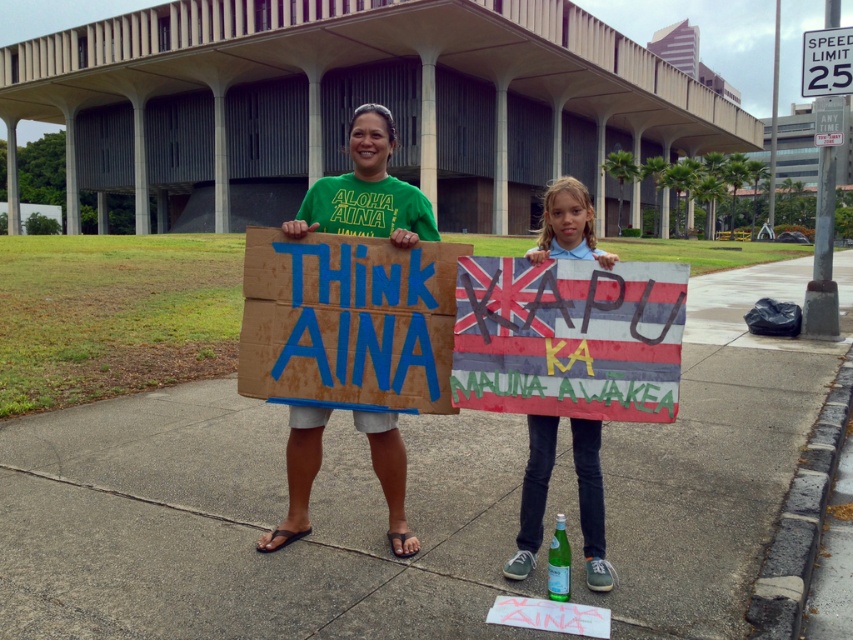
Question: Which of the following is the farthest from the observer?

Choices:
 (A) matte cardboard sign at center
 (B) cardboard sign at center
 (C) white cotton shirt at center
 (D) brown concrete pavement at center

Answer: (A)

Question: Is the position of matte cardboard sign at center more distant than that of white plastic speed limit sign at upper right?

Choices:
 (A) yes
 (B) no

Answer: (B)

Question: Which of the following is the farthest from the observer?

Choices:
 (A) (851, 60)
 (B) (392, 131)

Answer: (A)

Question: Which point is farther to the camera?

Choices:
 (A) white cotton shirt at center
 (B) hand-painted fabric sign at center
 (C) brown concrete pavement at center
 (D) matte cardboard sign at center

Answer: (D)

Question: Does brown concrete pavement at center appear on the right side of white plastic speed limit sign at upper right?

Choices:
 (A) yes
 (B) no

Answer: (B)

Question: Can you confirm if brown concrete pavement at center is positioned to the left of cardboard sign at center?

Choices:
 (A) no
 (B) yes

Answer: (A)